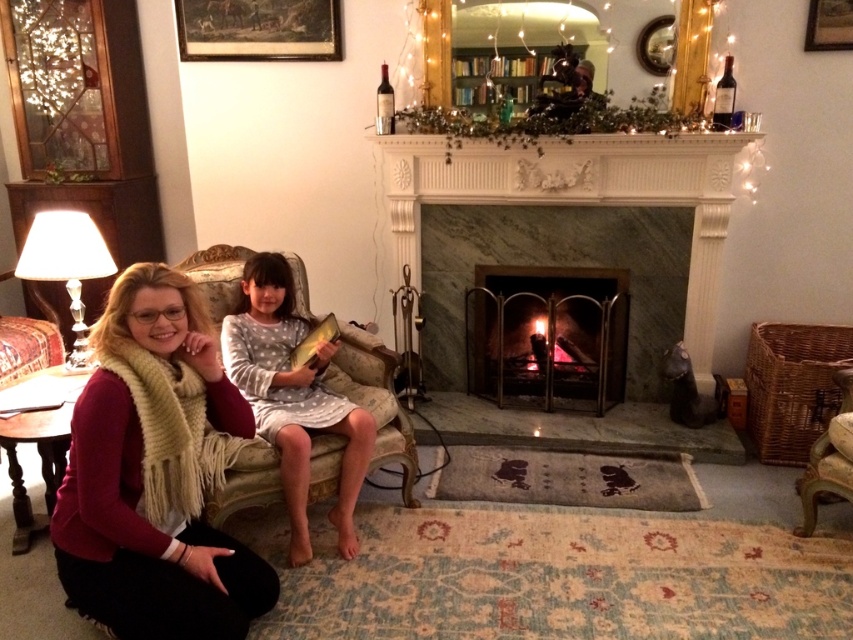
Does wooden framed painting at upper left have a greater width compared to wooden armchair at lower right?

Yes.

Does point (213, 22) lie behind point (805, 525)?

Yes, point (213, 22) is farther from viewer.

Is point (303, 44) farther from viewer compared to point (828, 449)?

Yes, point (303, 44) is behind point (828, 449).

I want to click on wooden framed painting at upper left, so click(x=258, y=29).

Can you confirm if marble fireplace at center is smaller than wooden armchair at lower right?

Actually, marble fireplace at center might be larger than wooden armchair at lower right.

Is marble fireplace at center thinner than wooden armchair at lower right?

No, marble fireplace at center is not thinner than wooden armchair at lower right.

The height and width of the screenshot is (640, 853). In order to click on marble fireplace at center in this screenshot , I will do `click(577, 195)`.

Based on the photo, is wooden framed painting at upper left positioned at the back of wooden picture frame at upper right?

Yes, wooden framed painting at upper left is further from the viewer.

Who is positioned more to the right, wooden framed painting at upper left or wooden picture frame at upper right?

wooden picture frame at upper right is more to the right.

Based on the photo, measure the distance between point (186, 35) and camera.

3.75 meters

Where is `wooden framed painting at upper left`? This screenshot has height=640, width=853. wooden framed painting at upper left is located at coordinates (258, 29).